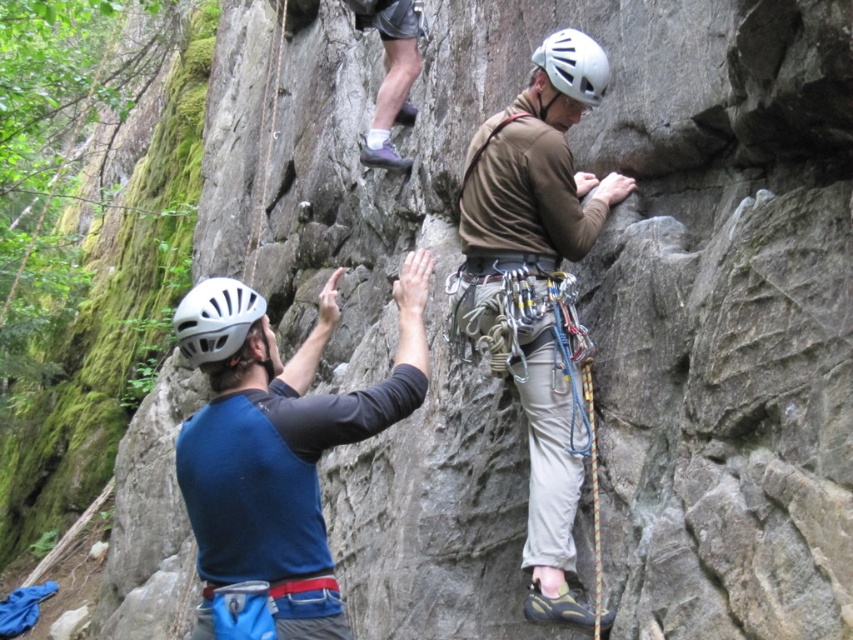
Question: Estimate the real-world distances between objects in this image. Which object is farther from the blue fabric shirt at center?

Choices:
 (A) rope at upper center
 (B) white matte helmet at center
 (C) matte brown shirt at center

Answer: (A)

Question: Which of the following is the farthest from the observer?

Choices:
 (A) matte brown shirt at center
 (B) blue fabric shirt at center
 (C) white matte helmet at upper center

Answer: (C)

Question: Which is nearer to the white matte helmet at center?

Choices:
 (A) blue fabric shirt at center
 (B) rope at upper center

Answer: (A)

Question: Can you confirm if white matte helmet at upper center is positioned above rope at upper center?

Choices:
 (A) yes
 (B) no

Answer: (B)

Question: Where is white matte helmet at center located in relation to rope at upper center in the image?

Choices:
 (A) above
 (B) below

Answer: (B)

Question: Observing the image, what is the correct spatial positioning of matte brown shirt at center in reference to blue fabric shirt at center?

Choices:
 (A) below
 (B) above

Answer: (B)